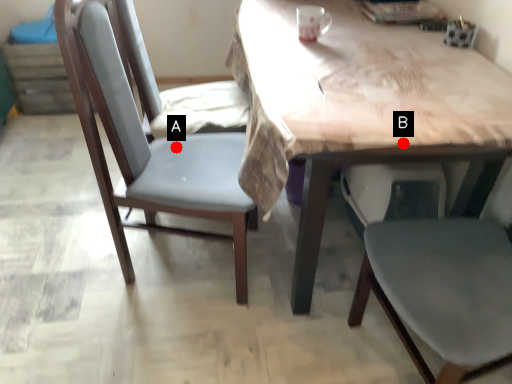
Question: Two points are circled on the image, labeled by A and B beside each circle. Among these points, which one is farthest from the camera?

Choices:
 (A) A is further
 (B) B is further

Answer: (A)